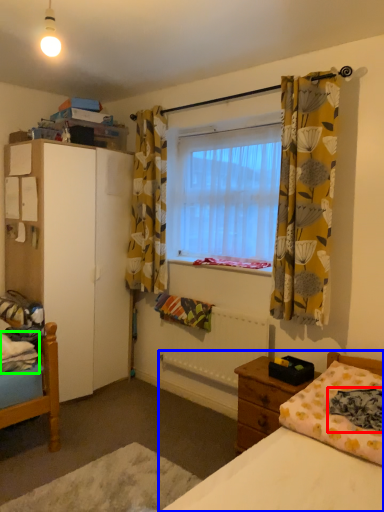
Question: Which object is positioned closest to blanket (highlighted by a red box)? Select from bed (highlighted by a blue box) and sheet (highlighted by a green box).

Choices:
 (A) bed
 (B) sheet

Answer: (A)